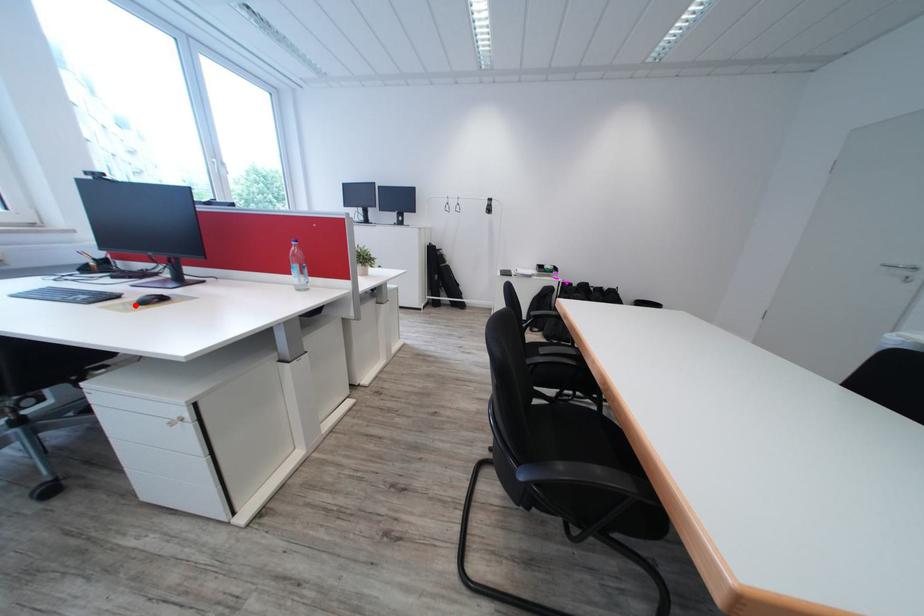
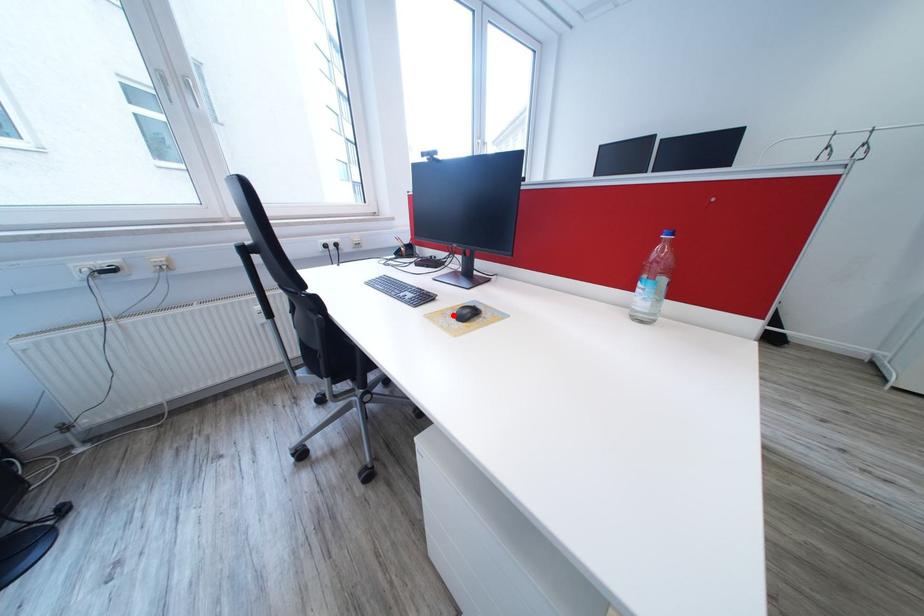
I am providing you with two images of the same scene from different viewpoints. A red point is marked on the first image and another point is marked on the second image. Do the highlighted points in image1 and image2 indicate the same real-world spot?

Yes